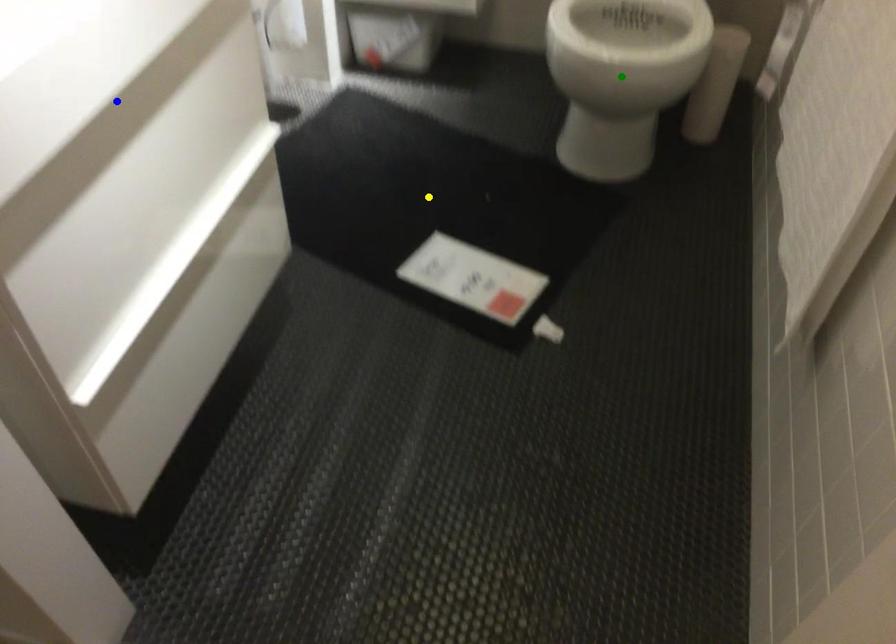
Order these from nearest to farthest:
1. blue point
2. green point
3. yellow point

blue point < green point < yellow point